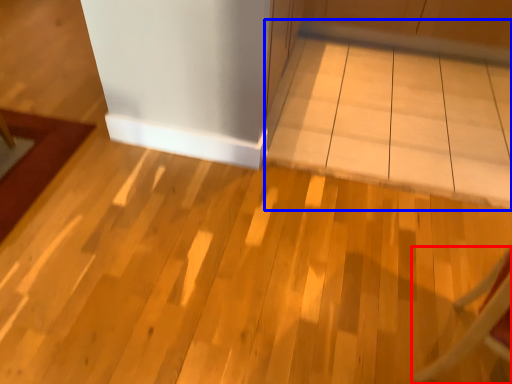
Question: Which of the following is the farthest to the observer, furniture (highlighted by a red box) or table (highlighted by a blue box)?

Choices:
 (A) furniture
 (B) table

Answer: (B)